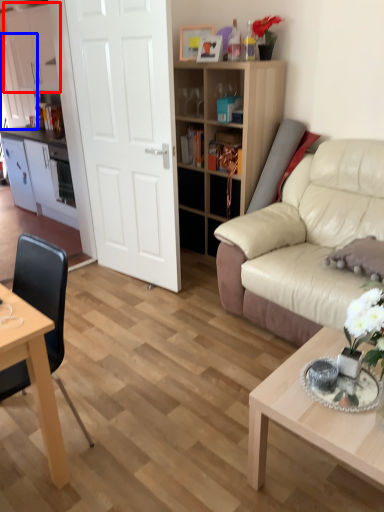
Question: Which object appears farthest to the camera in this image, cabinetry (highlighted by a red box) or cabinetry (highlighted by a blue box)?

Choices:
 (A) cabinetry
 (B) cabinetry

Answer: (B)